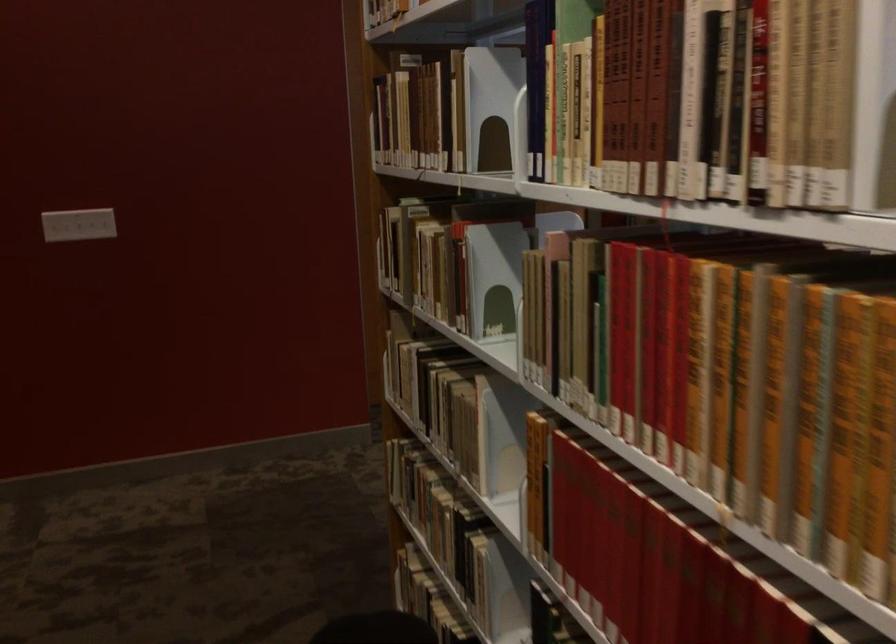
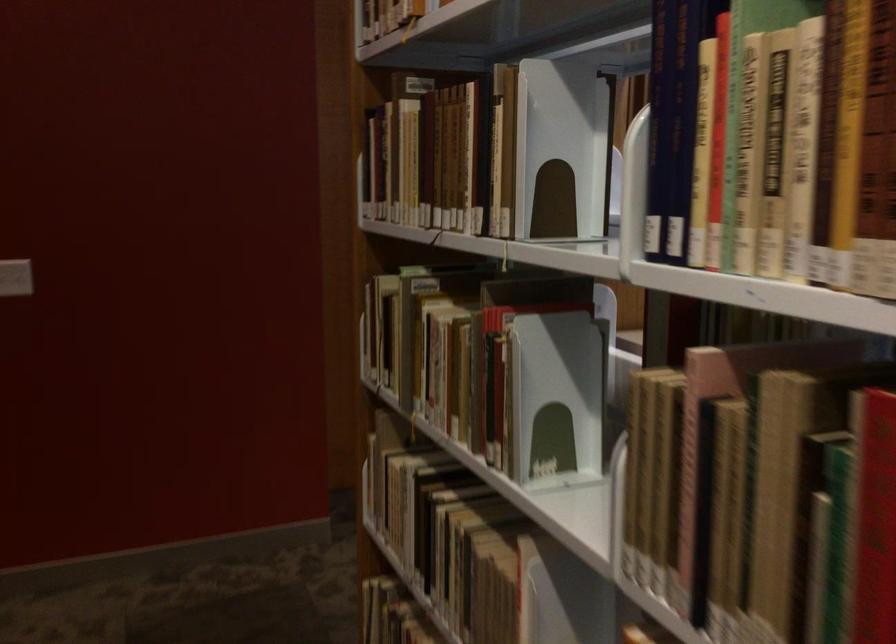
Locate, in the second image, the point that corresponds to pixel 435 388 in the first image.

(445, 532)